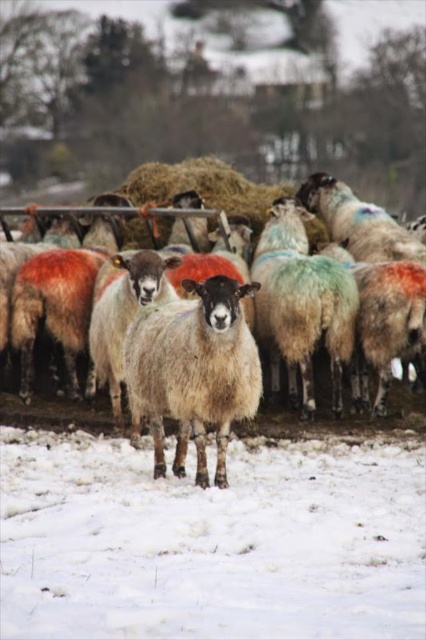
Question: Observing the image, what is the correct spatial positioning of white woolen sheep at center in reference to fuzzy woolen sheep at center?

Choices:
 (A) right
 (B) left

Answer: (B)

Question: Which point is farther to the camera?

Choices:
 (A) fuzzy woolen sheep at center
 (B) fuzzy woolly sheep at center
 (C) white woolen sheep at center

Answer: (C)

Question: Does fuzzy woolly sheep at center appear on the left side of fuzzy woolen sheep at center?

Choices:
 (A) yes
 (B) no

Answer: (A)

Question: Estimate the real-world distances between objects in this image. Which object is farther from the white woolen sheep at center?

Choices:
 (A) fuzzy woolly sheep at center
 (B) fuzzy woolen sheep at center

Answer: (A)

Question: Is fuzzy woolly sheep at center below white woolen sheep at center?

Choices:
 (A) yes
 (B) no

Answer: (A)

Question: Which is farther from the fuzzy woolen sheep at center?

Choices:
 (A) fuzzy woolly sheep at center
 (B) white woolen sheep at center

Answer: (A)